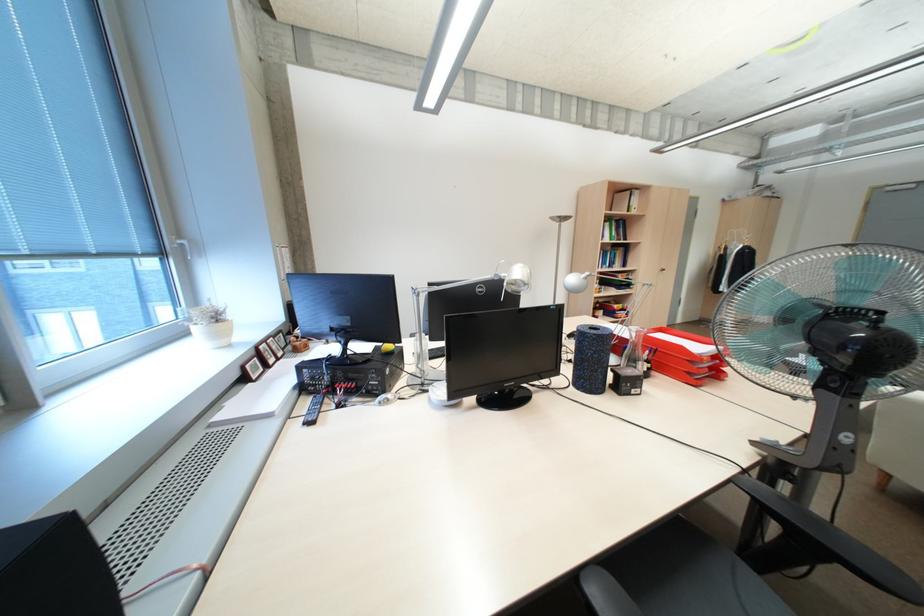
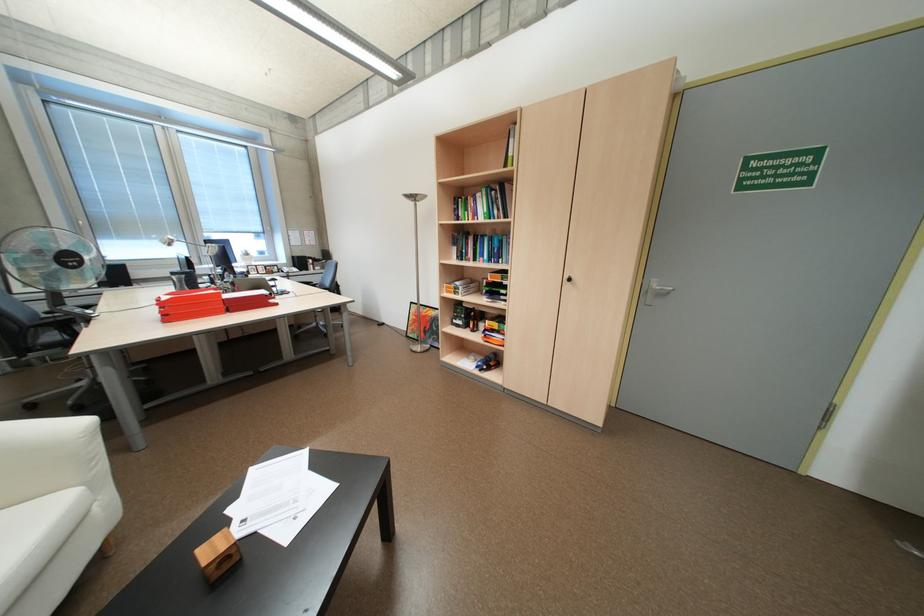
Locate, in the second image, the point that corresponds to [609,292] in the first image.

(465, 293)